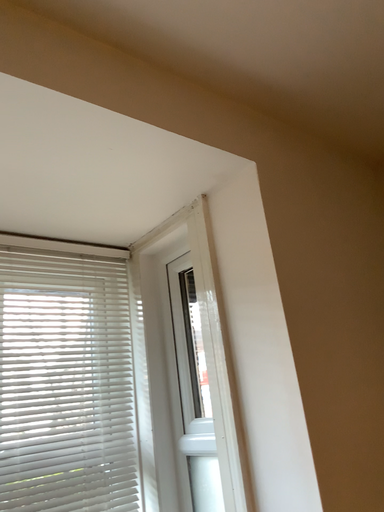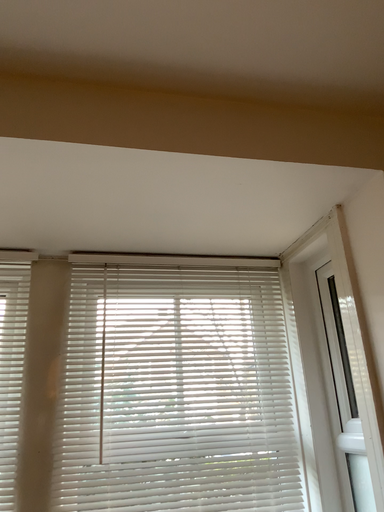
Question: How did the camera likely rotate when shooting the video?

Choices:
 (A) rotated left
 (B) rotated right

Answer: (A)